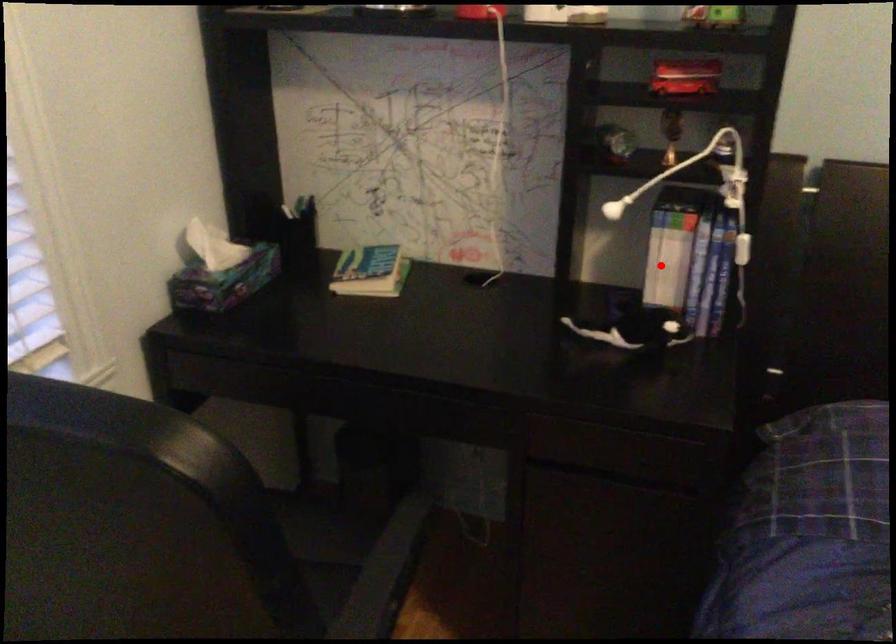
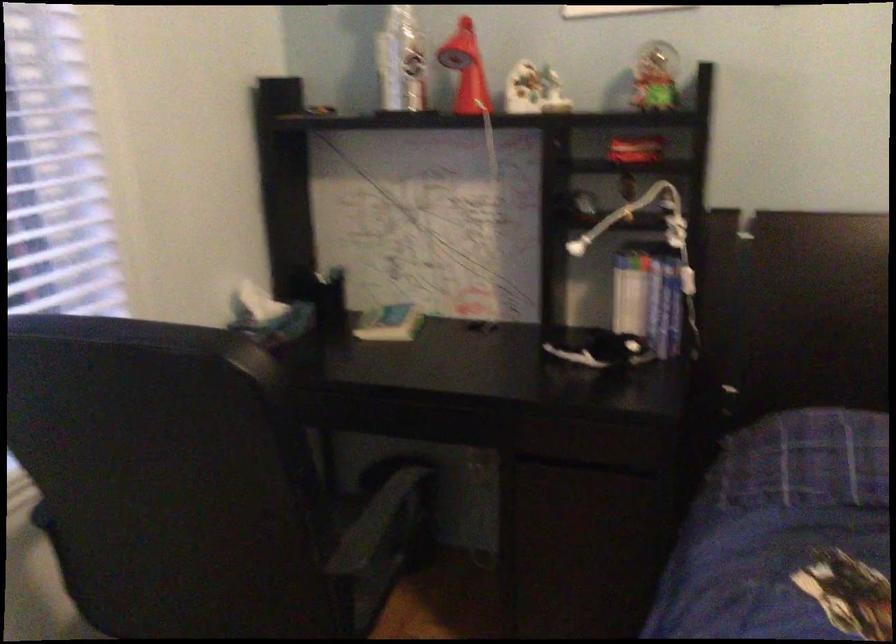
Locate, in the second image, the point that corresponds to the highlighted location in the first image.

(629, 301)